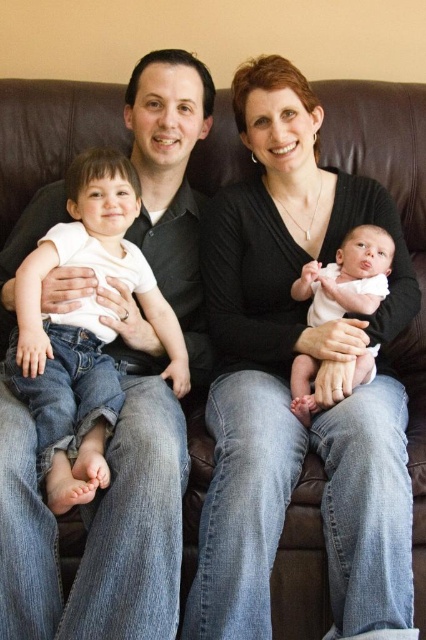
Question: Which is nearer to the matte black shirt at left?

Choices:
 (A) black matte sweater at center
 (B) soft pink fabric baby at center

Answer: (A)

Question: Is black matte sweater at center smaller than soft pink fabric baby at center?

Choices:
 (A) yes
 (B) no

Answer: (B)

Question: Which point appears closest to the camera in this image?

Choices:
 (A) (31, 531)
 (B) (190, 586)
 (C) (362, 376)

Answer: (A)

Question: Can you confirm if black matte sweater at center is positioned to the right of soft pink fabric baby at center?

Choices:
 (A) no
 (B) yes

Answer: (A)

Question: Is black matte sweater at center above matte black shirt at left?

Choices:
 (A) no
 (B) yes

Answer: (B)

Question: Which object is farther from the camera taking this photo?

Choices:
 (A) soft pink fabric baby at center
 (B) matte black shirt at left
 (C) black matte sweater at center

Answer: (A)